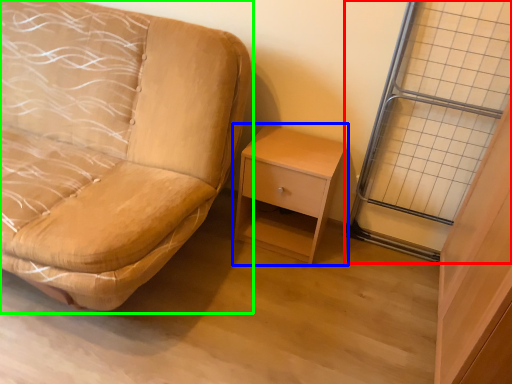
Question: Which object is positioned closest to glass door (highlighted by a red box)? Select from nightstand (highlighted by a blue box) and studio couch (highlighted by a green box).

Choices:
 (A) nightstand
 (B) studio couch

Answer: (A)